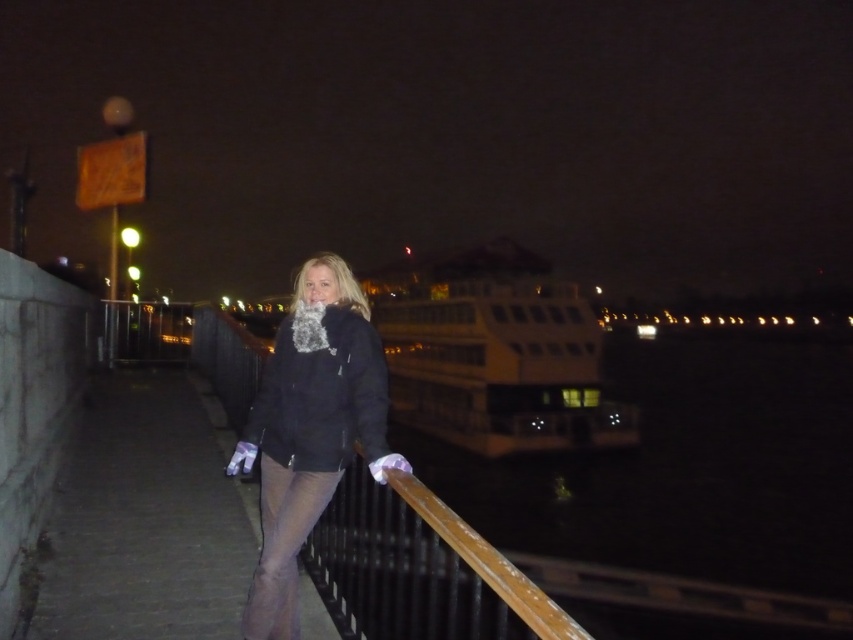
You are a photographer trying to capture the entire scene of the wooden at center and the matte black jacket at center in one shot. Given that the camera can only focus on objects within a 1.5 meter width, will both objects fit in the frame?

The wooden at center is narrower than the matte black jacket at center, but since the camera can focus on objects within a 1.5 meter width, both objects can fit in the frame as long as their combined width does not exceed the camera limit.

You are a delivery robot with a height of 1.5 meters. You are standing on the wooden at center in the image. The railing is between you and the water. Can you see the illuminated boat in the background over the railing?

The wooden at center and viewer are 2.03 meters apart from each other. Since the delivery robot is 1.5 meters tall, it can likely see over the railing to the illuminated boat in the background as the distance between them is greater than the robot height.

You are standing at the point labeled as point (418, 568) in the image. What is the material of the object located at that point?

The point (418, 568) corresponds to wooden at center, so the material is wooden.